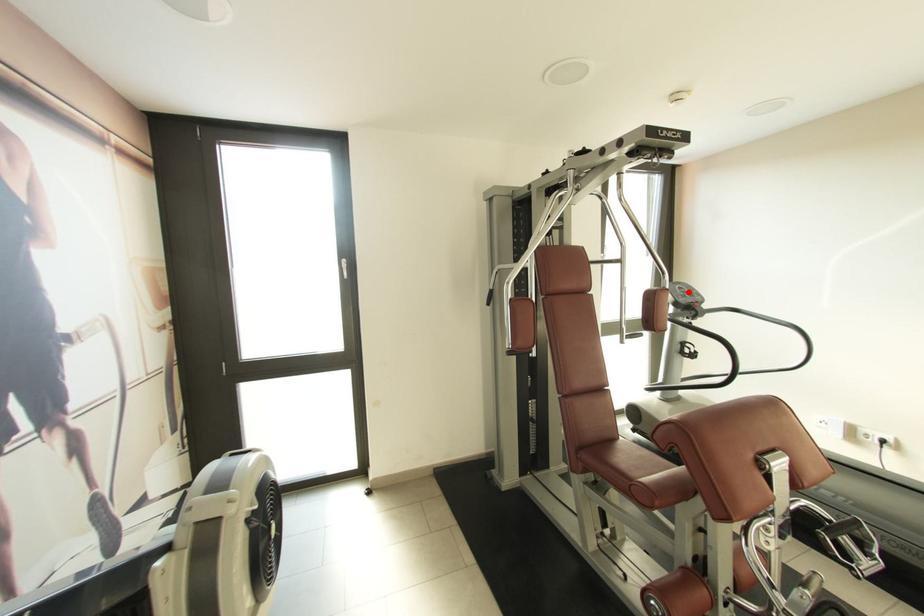
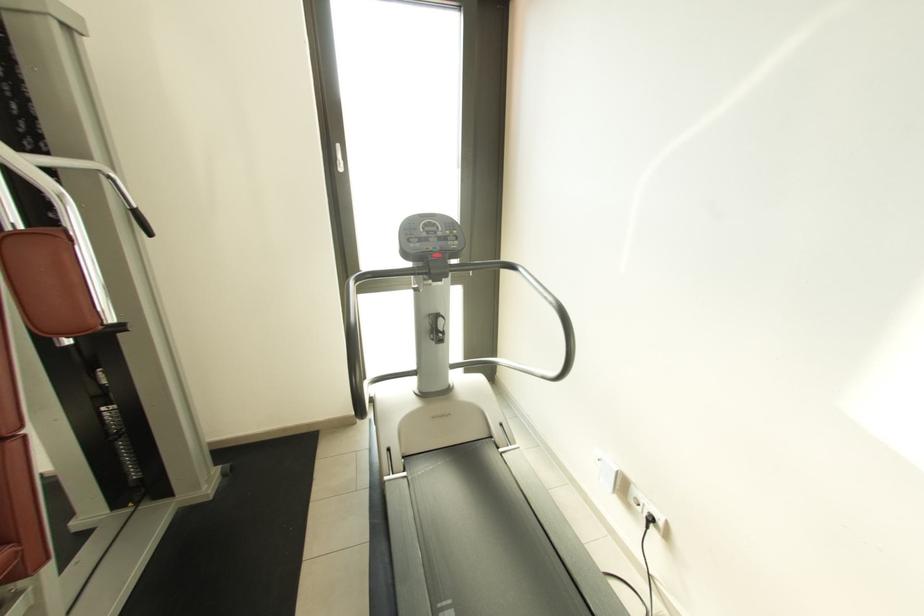
Question: A red point is marked in image1. In image2, is the corresponding 3D point closer to the camera or farther? Reply with the corresponding letter.

Choices:
 (A) The corresponding 3D point is closer.
 (B) The corresponding 3D point is farther.

Answer: (A)